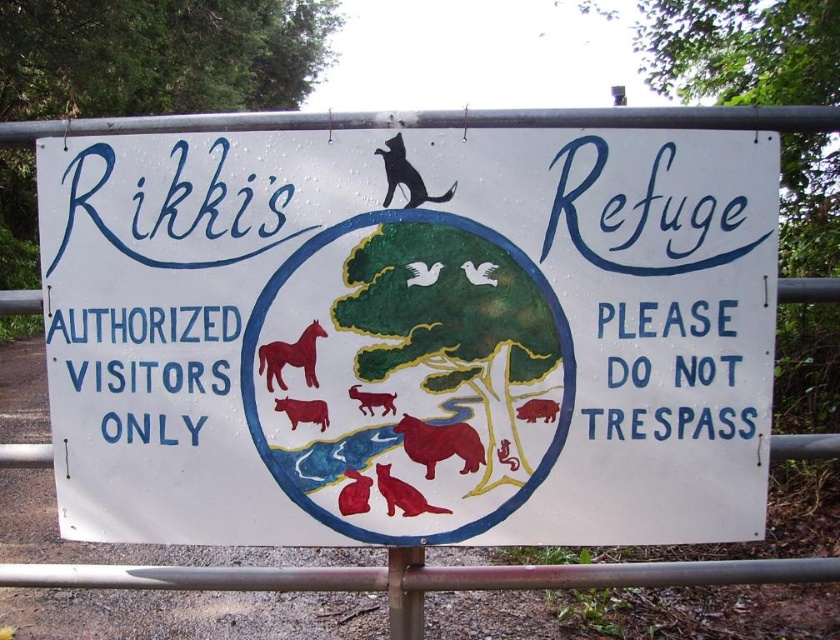
You are standing in front of the signboard at Rikki Refuge. You see two points marked on the signboard. The first point is at coordinates point [378,404] and the second point is at point [474,280]. Which point is closer to you?

Point [378,404] is further to the viewer than point [474,280], so the second point is closer to you.

You are standing in front of the signboard for Rikki s Refuge and need to locate the brown matte dog at center. Based on the coordinates provided in the Objects Description, can you determine its position relative to the other elements on the sign?

The brown matte dog at center is located at point coordinates (371, 401), which places it centrally on the signboard. This position is likely in the circular illustration area described in the Scene, surrounded by the green tree and other red animals mentioned.

You are standing in front of the signboard for Rikki Refuge. You see a matte red horse at center and a white glossy dove at center. Which animal is positioned to the left?

The matte red horse at center is positioned to the left of the white glossy dove at center.